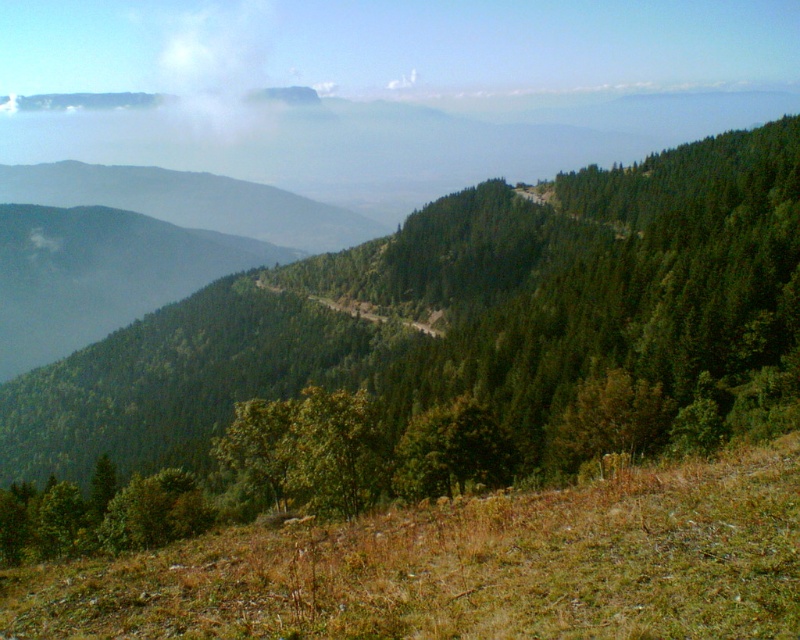
Is green leafy tree at center wider than green matte tree at center?

Indeed, green leafy tree at center has a greater width compared to green matte tree at center.

Consider the image. Can you confirm if green leafy tree at center is positioned to the left of green matte tree at center?

Indeed, green leafy tree at center is positioned on the left side of green matte tree at center.

Which is behind, point (354, 282) or point (478, 460)?

Point (354, 282)

The image size is (800, 640). Identify the location of green leafy tree at center. (440, 348).

Who is lower down, white fog at upper left or green matte tree at center?

green matte tree at center is lower down.

Is point (166, 29) positioned after point (450, 449)?

Yes.

Is point (198, 72) positioned after point (432, 480)?

Yes.

The height and width of the screenshot is (640, 800). In order to click on white fog at upper left in this screenshot , I will do `click(216, 67)`.

At what (x,y) coordinates should I click in order to perform the action: click on green leafy tree at center. Please return your answer as a coordinate pair (x, y). Looking at the image, I should click on (440, 348).

Is green leafy tree at center wider than white fog at upper left?

Yes.

The image size is (800, 640). What do you see at coordinates (440, 348) in the screenshot?
I see `green leafy tree at center` at bounding box center [440, 348].

What are the coordinates of `green leafy tree at center` in the screenshot? It's located at (440, 348).